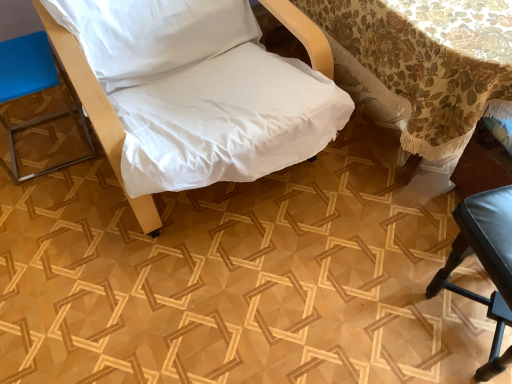
Identify the location of free point below blue leather stool at left, marked as the third furniture in a right-to-left arrangement (from a real-world perspective). pos(52,144).